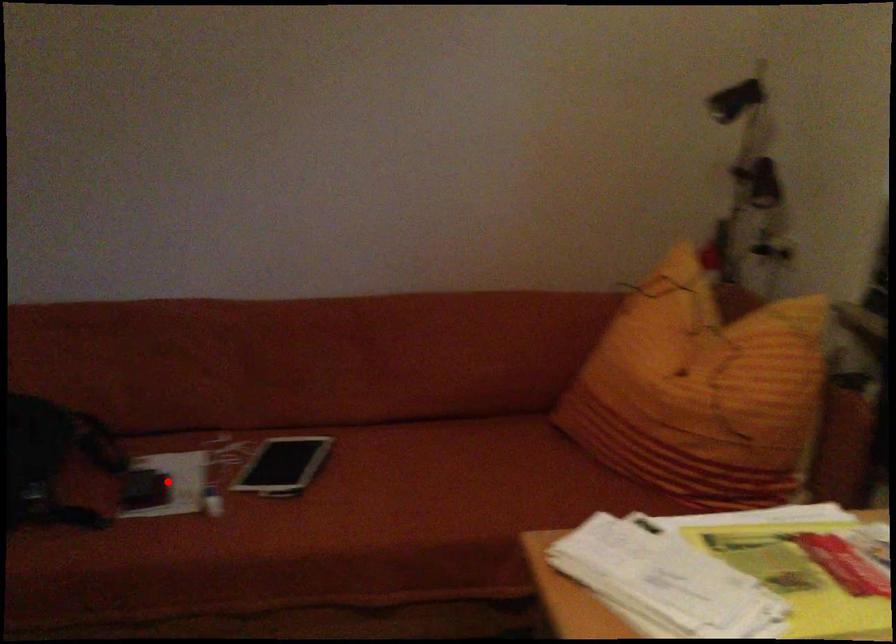
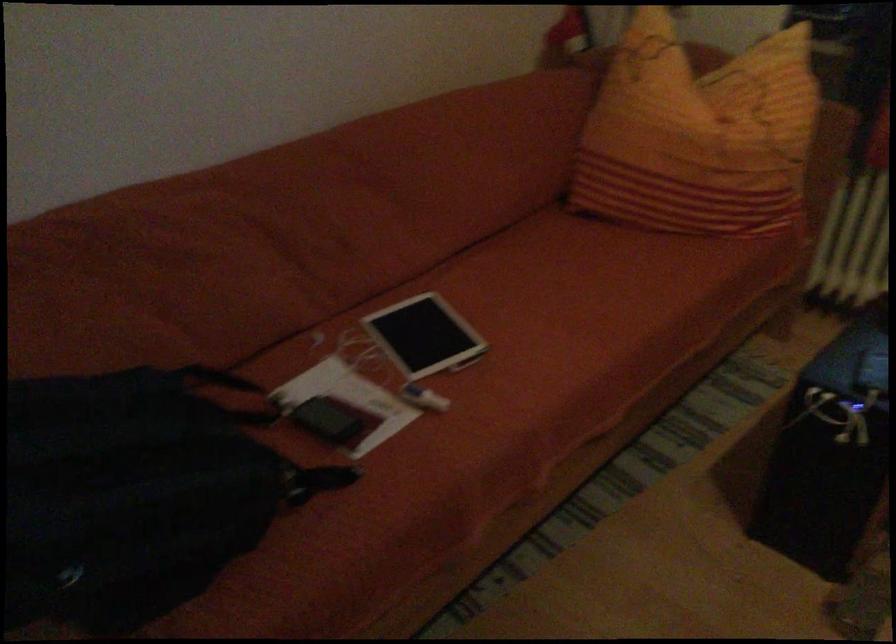
The point at the highlighted location is marked in the first image. Where is the corresponding point in the second image?

(350, 401)